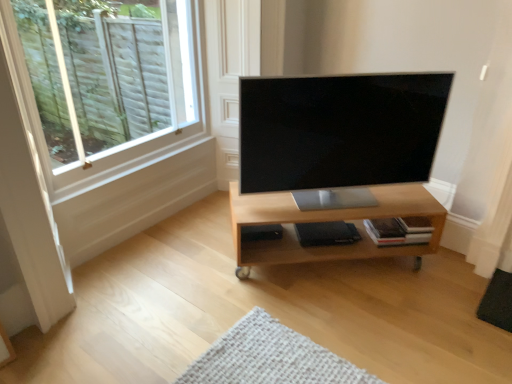
Question: Is white wood window at upper left in front of satin black tv at center?

Choices:
 (A) yes
 (B) no

Answer: (A)

Question: Is white wood window at upper left smaller than satin black tv at center?

Choices:
 (A) yes
 (B) no

Answer: (B)

Question: Considering the relative sizes of white wood window at upper left and satin black tv at center in the image provided, is white wood window at upper left shorter than satin black tv at center?

Choices:
 (A) yes
 (B) no

Answer: (B)

Question: Can we say white wood window at upper left lies outside satin black tv at center?

Choices:
 (A) no
 (B) yes

Answer: (B)

Question: Would you say white wood window at upper left contains satin black tv at center?

Choices:
 (A) yes
 (B) no

Answer: (B)

Question: Does white wood window at upper left appear on the right side of satin black tv at center?

Choices:
 (A) no
 (B) yes

Answer: (A)

Question: Is white wood window at upper left not close to light wood shelf at center?

Choices:
 (A) yes
 (B) no

Answer: (A)

Question: Considering the relative sizes of white wood window at upper left and light wood shelf at center in the image provided, is white wood window at upper left shorter than light wood shelf at center?

Choices:
 (A) no
 (B) yes

Answer: (A)

Question: Considering the relative sizes of white wood window at upper left and light wood shelf at center in the image provided, is white wood window at upper left bigger than light wood shelf at center?

Choices:
 (A) no
 (B) yes

Answer: (A)

Question: Is white wood window at upper left at the right side of light wood shelf at center?

Choices:
 (A) yes
 (B) no

Answer: (B)

Question: From a real-world perspective, is white wood window at upper left below light wood shelf at center?

Choices:
 (A) yes
 (B) no

Answer: (B)

Question: Can light wood shelf at center be found inside white wood window at upper left?

Choices:
 (A) yes
 (B) no

Answer: (B)

Question: Is light wood shelf at center oriented away from white wood window at upper left?

Choices:
 (A) yes
 (B) no

Answer: (B)